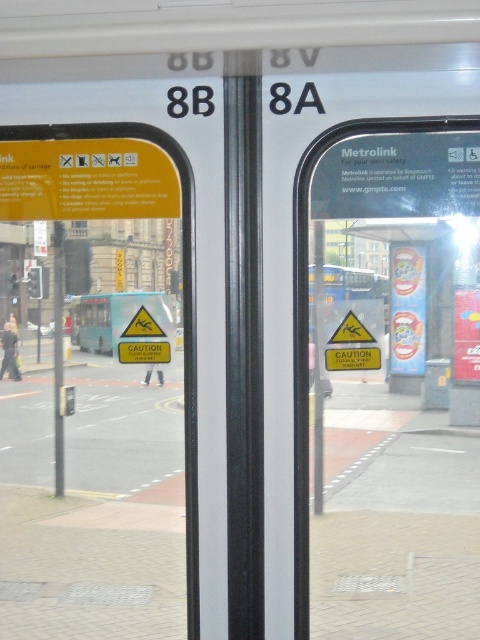
Between yellow caution sign at center and yellow caution sign at left, which one is positioned lower?

Positioned lower is yellow caution sign at center.

Image resolution: width=480 pixels, height=640 pixels. Describe the element at coordinates (307, 323) in the screenshot. I see `yellow caution sign at center` at that location.

Where is `yellow caution sign at center`? This screenshot has width=480, height=640. yellow caution sign at center is located at coordinates (307, 323).